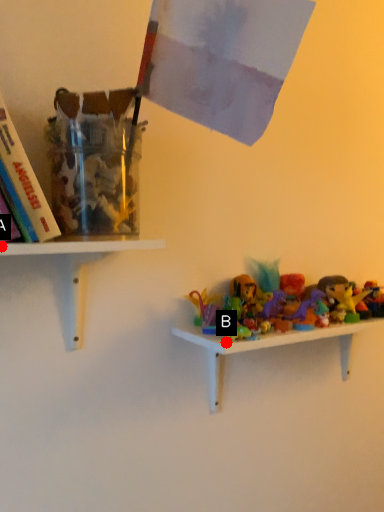
Question: Two points are circled on the image, labeled by A and B beside each circle. Which of the following is the farthest from the observer?

Choices:
 (A) A is further
 (B) B is further

Answer: (B)